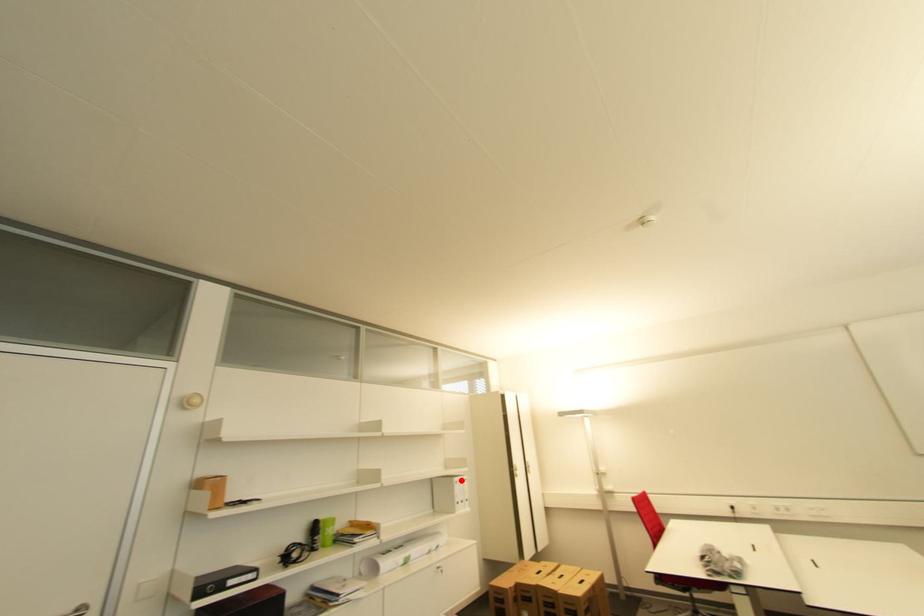
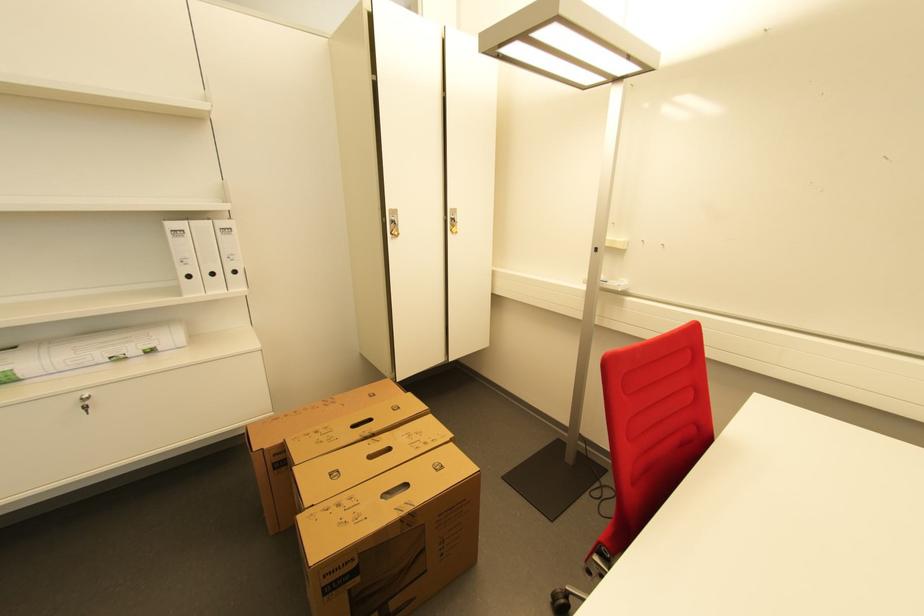
Question: A red point is marked in image1. In image2, is the corresponding 3D point closer to the camera or farther? Reply with the corresponding letter.

Choices:
 (A) The corresponding 3D point is closer.
 (B) The corresponding 3D point is farther.

Answer: (A)